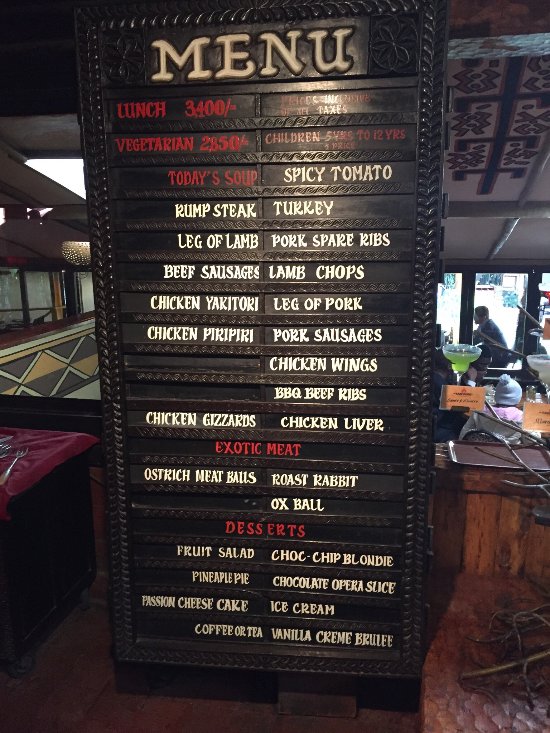
Where is `fork`? fork is located at coordinates (16, 463).